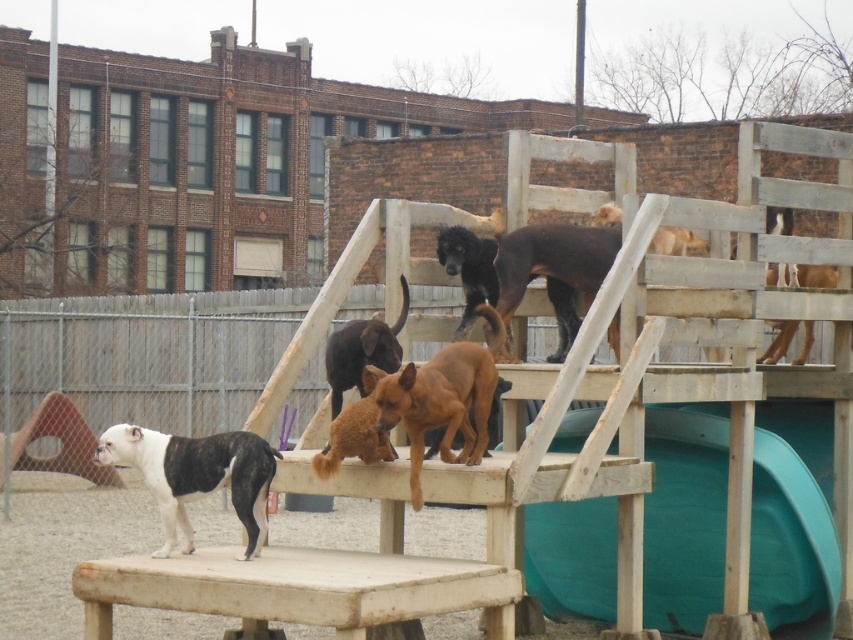
Question: Can you confirm if white/black fur dog at lower left is thinner than black glossy dog at upper center?

Choices:
 (A) yes
 (B) no

Answer: (B)

Question: Is black glossy dog at upper center thinner than brown furry dog at center?

Choices:
 (A) yes
 (B) no

Answer: (B)

Question: Which point is closer to the camera?

Choices:
 (A) (245, 436)
 (B) (334, 390)

Answer: (A)

Question: Can you confirm if brown matte dog at center is positioned to the right of brown furry dog at upper right?

Choices:
 (A) no
 (B) yes

Answer: (A)

Question: Which of the following is the farthest from the observer?

Choices:
 (A) (450, 410)
 (B) (366, 358)

Answer: (B)

Question: Considering the real-world distances, which object is farthest from the teal plastic slide at center right?

Choices:
 (A) brown furry dog at upper right
 (B) white/black fur dog at lower left

Answer: (B)